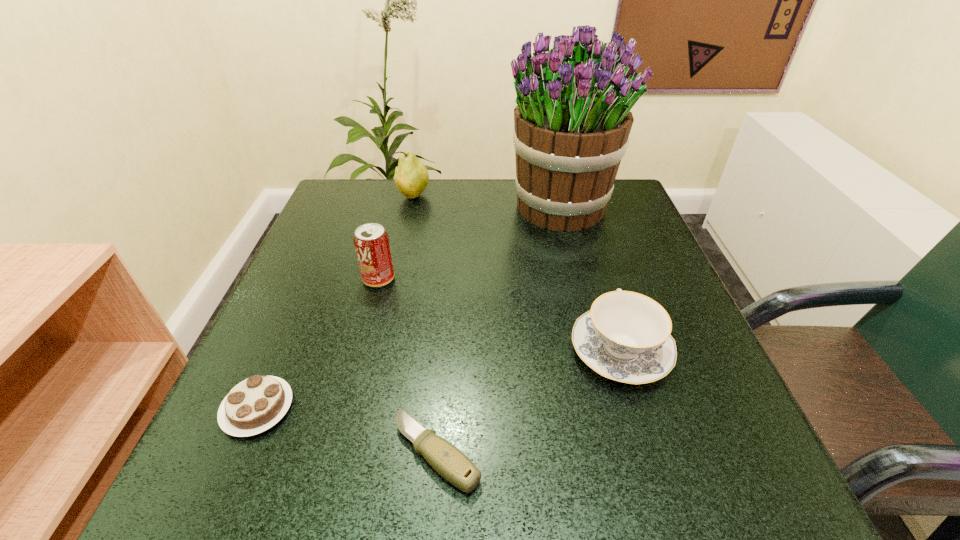
Image resolution: width=960 pixels, height=540 pixels. I want to click on blank space that satisfies the following two spatial constraints: 1. on the front side of the pear; 2. on the left side of the bouquet, so click(x=411, y=207).

Identify the location of vacant space that satisfies the following two spatial constraints: 1. on the front side of the shortest object; 2. on the left side of the chocolate cake. (239, 453).

You are a GUI agent. You are given a task and a screenshot of the screen. Output one action in this format:
    pyautogui.click(x=<x>, y=<y>)
    Task: Click on the free space that satisfies the following two spatial constraints: 1. on the front side of the pocketknife; 2. on the right side of the leftmost object
    Image resolution: width=960 pixels, height=540 pixels.
    Given the screenshot: What is the action you would take?
    pyautogui.click(x=239, y=453)